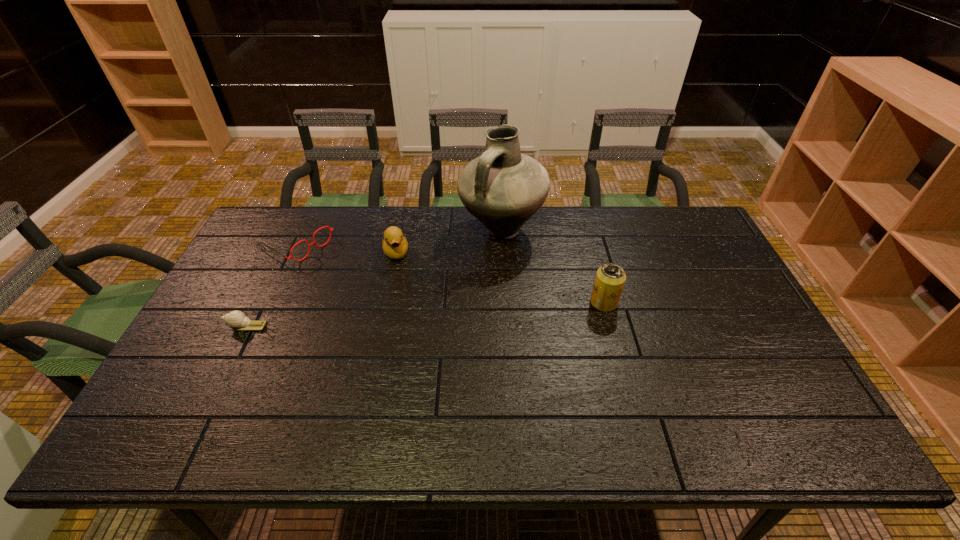
Locate an element on the screen. This screenshot has width=960, height=540. vacant space located on the handle side of the second object from right to left is located at coordinates (474, 304).

You are a GUI agent. You are given a task and a screenshot of the screen. Output one action in this format:
    pyautogui.click(x=<x>, y=<y>)
    Task: Click on the duckling located in the far edge section of the desktop
    This screenshot has width=960, height=540.
    Given the screenshot: What is the action you would take?
    pyautogui.click(x=394, y=244)

I want to click on spectacles that is at the far edge, so click(x=309, y=245).

What are the coordinates of `pitcher located at the far edge` in the screenshot? It's located at (503, 188).

Where is `escargot present at the left edge`? escargot present at the left edge is located at coordinates pyautogui.click(x=237, y=320).

Where is `spectacles that is at the left edge`? spectacles that is at the left edge is located at coordinates (309, 245).

Image resolution: width=960 pixels, height=540 pixels. What are the coordinates of `object present at the far left corner` in the screenshot? It's located at (309, 245).

The width and height of the screenshot is (960, 540). In the image, there is a desktop. What are the coordinates of `free space at the far edge` in the screenshot? It's located at [x=348, y=207].

Where is `free space at the left edge of the desktop`? Image resolution: width=960 pixels, height=540 pixels. free space at the left edge of the desktop is located at coordinates (230, 367).

The height and width of the screenshot is (540, 960). In the image, there is a desktop. What are the coordinates of `vacant area at the right edge` in the screenshot? It's located at (704, 279).